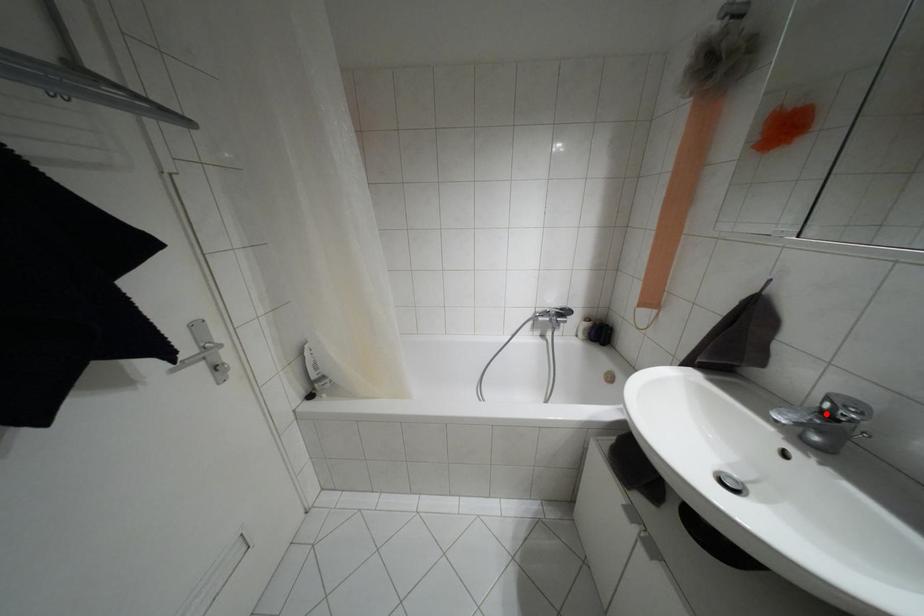
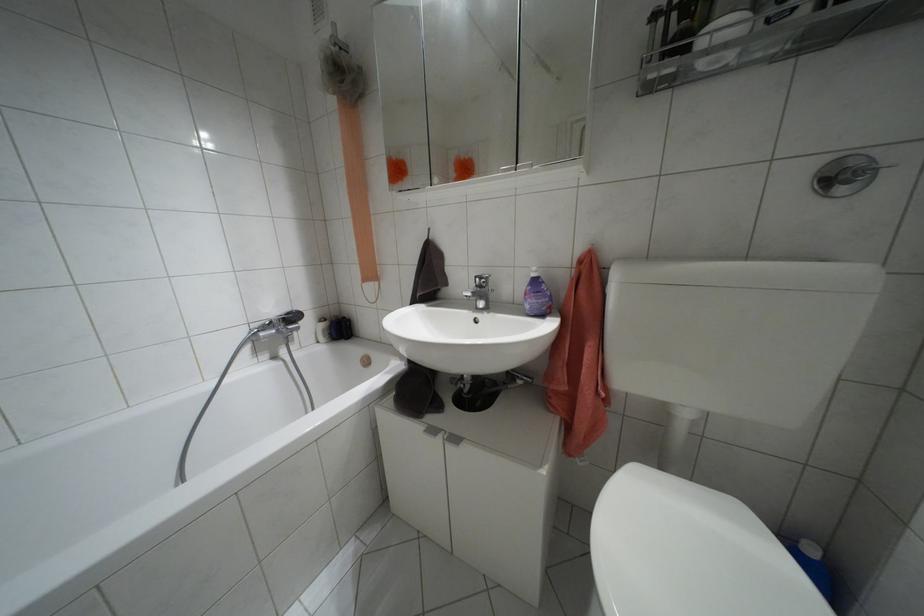
The point at the highlighted location is marked in the first image. Where is the corresponding point in the second image?

(479, 286)